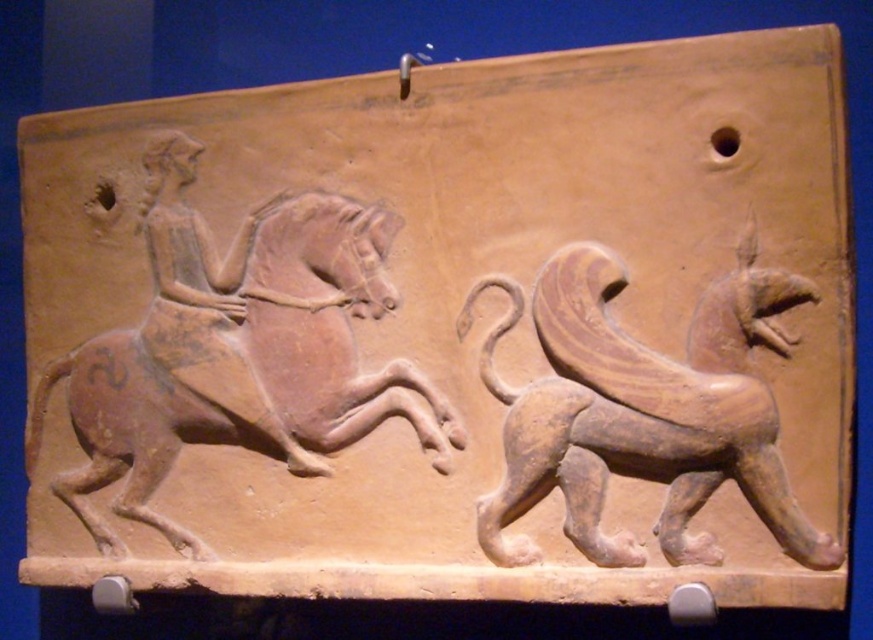
Who is more distant from viewer, (95, 438) or (689, 470)?

Positioned behind is point (95, 438).

Is earthenware horse at left above brown clay lion at right?

Yes, earthenware horse at left is above brown clay lion at right.

Between point (435, 396) and point (595, 513), which one is positioned behind?

The point (435, 396) is more distant.

This screenshot has width=873, height=640. What are the coordinates of `earthenware horse at left` in the screenshot? It's located at (239, 360).